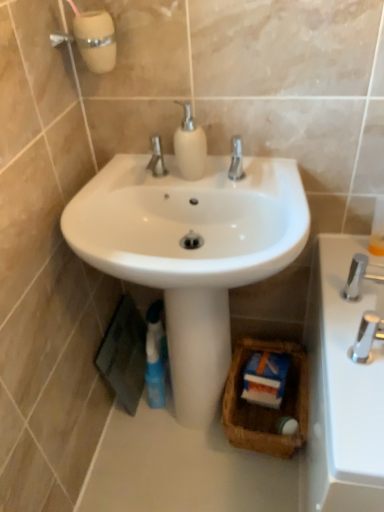
Find the location of a particular element. chrome metallic faucet at right, the second tap viewed from the back is located at coordinates (366, 336).

The width and height of the screenshot is (384, 512). What do you see at coordinates (155, 356) in the screenshot?
I see `blue glossy mouthwash at lower center` at bounding box center [155, 356].

In order to click on white matte soap dispenser at center in this screenshot , I will do point(190,145).

Find the location of a particular element. chrome metallic faucet at right, which is counted as the 1th tap, starting from the front is located at coordinates (366, 336).

Is white glossy sink at center facing towards blue glossy mouthwash at lower center?

No, white glossy sink at center does not turn towards blue glossy mouthwash at lower center.

Does white glossy sink at center have a greater height compared to blue glossy mouthwash at lower center?

No.

Is white glossy sink at center far from blue glossy mouthwash at lower center?

white glossy sink at center is near blue glossy mouthwash at lower center, not far away.

From a real-world perspective, does silver metallic tap at right, which is counted as the 1th tap, starting from the back, sit lower than chrome metallic faucet at right, which is counted as the 1th tap, starting from the front?

Yes, from a real-world perspective, silver metallic tap at right, which is counted as the 1th tap, starting from the back, is beneath chrome metallic faucet at right, which is counted as the 1th tap, starting from the front.

From the image's perspective, is silver metallic tap at right, arranged as the 2th tap when viewed from the front, positioned above or below chrome metallic faucet at right, the second tap viewed from the back?

silver metallic tap at right, arranged as the 2th tap when viewed from the front, is situated higher than chrome metallic faucet at right, the second tap viewed from the back, in the image.

Looking at their sizes, would you say silver metallic tap at right, which is counted as the 1th tap, starting from the back, is wider or thinner than chrome metallic faucet at right, which is counted as the 1th tap, starting from the front?

Clearly, silver metallic tap at right, which is counted as the 1th tap, starting from the back, has more width compared to chrome metallic faucet at right, which is counted as the 1th tap, starting from the front.

Does chrome metallic faucet at right, the second tap viewed from the back, have a greater width compared to silver metallic tap at right, arranged as the 2th tap when viewed from the front?

No.

From the image's perspective, which is below, chrome metallic faucet at right, the second tap viewed from the back, or silver metallic tap at right, arranged as the 2th tap when viewed from the front?

From the image's view, chrome metallic faucet at right, the second tap viewed from the back, is below.

From a real-world perspective, is chrome metallic faucet at right, which is counted as the 1th tap, starting from the front, below silver metallic tap at right, which is counted as the 1th tap, starting from the back?

No, from a real-world perspective, chrome metallic faucet at right, which is counted as the 1th tap, starting from the front, is not below silver metallic tap at right, which is counted as the 1th tap, starting from the back.

Is silver metallic tap at right, arranged as the 2th tap when viewed from the front, aimed at blue glossy mouthwash at lower center?

No, silver metallic tap at right, arranged as the 2th tap when viewed from the front, is not aimed at blue glossy mouthwash at lower center.

Does point (350, 284) appear closer or farther from the camera than point (164, 400)?

Clearly, point (350, 284) is closer to the camera than point (164, 400).

From the image's perspective, is silver metallic tap at right, arranged as the 2th tap when viewed from the front, located above blue glossy mouthwash at lower center?

Yes, from the image's perspective, silver metallic tap at right, arranged as the 2th tap when viewed from the front, is above blue glossy mouthwash at lower center.

Which is more to the left, silver metallic tap at right, arranged as the 2th tap when viewed from the front, or blue glossy mouthwash at lower center?

blue glossy mouthwash at lower center is more to the left.

Are brown woven basket at center and chrome metallic faucet at right, which is counted as the 1th tap, starting from the front, located far from each other?

Actually, brown woven basket at center and chrome metallic faucet at right, which is counted as the 1th tap, starting from the front, are a little close together.

Who is more distant, brown woven basket at center or chrome metallic faucet at right, which is counted as the 1th tap, starting from the front?

brown woven basket at center is further from the camera.

Is brown woven basket at center not inside chrome metallic faucet at right, the second tap viewed from the back?

Absolutely, brown woven basket at center is external to chrome metallic faucet at right, the second tap viewed from the back.

From the image's perspective, is brown woven basket at center under chrome metallic faucet at right, which is counted as the 1th tap, starting from the front?

Correct, brown woven basket at center appears lower than chrome metallic faucet at right, which is counted as the 1th tap, starting from the front, in the image.

Choose the correct answer: Is blue glossy mouthwash at lower center inside chrome metallic faucet at right, the second tap viewed from the back, or outside it?

blue glossy mouthwash at lower center is not enclosed by chrome metallic faucet at right, the second tap viewed from the back.

Find the location of a particular element. This screenshot has height=512, width=384. mouthwash on the left side of chrome metallic faucet at right, the second tap viewed from the back is located at coordinates (155, 356).

In the scene shown: Between blue glossy mouthwash at lower center and chrome metallic faucet at right, the second tap viewed from the back, which one has larger size?

blue glossy mouthwash at lower center.

Are blue glossy mouthwash at lower center and chrome metallic faucet at right, which is counted as the 1th tap, starting from the front, located far from each other?

No, blue glossy mouthwash at lower center is in close proximity to chrome metallic faucet at right, which is counted as the 1th tap, starting from the front.

Considering the relative sizes of blue glossy mouthwash at lower center and white matte soap dispenser at center in the image provided, is blue glossy mouthwash at lower center taller than white matte soap dispenser at center?

Correct, blue glossy mouthwash at lower center is much taller as white matte soap dispenser at center.

Is point (152, 307) in front of point (194, 142)?

No, (152, 307) is further to viewer.

Who is bigger, blue glossy mouthwash at lower center or white matte soap dispenser at center?

With larger size is blue glossy mouthwash at lower center.

Can you tell me how much blue glossy mouthwash at lower center and white matte soap dispenser at center differ in facing direction?

0.000546 degrees.

You are a GUI agent. You are given a task and a screenshot of the screen. Output one action in this format:
    pyautogui.click(x=<x>, y=<y>)
    Task: Click on the sink above the blue glossy mouthwash at lower center (from the image's perspective)
    
    Given the screenshot: What is the action you would take?
    pyautogui.click(x=189, y=222)

The height and width of the screenshot is (512, 384). Find the location of `tap lying on the left of silver metallic tap at right, which is counted as the 1th tap, starting from the back`. tap lying on the left of silver metallic tap at right, which is counted as the 1th tap, starting from the back is located at coordinates (366, 336).

Which object lies further to the anchor point white glossy sink at center, silver metallic tap at right, which is counted as the 1th tap, starting from the back, or blue glossy mouthwash at lower center?

blue glossy mouthwash at lower center lies further to white glossy sink at center than the other object.

Considering their positions, is chrome metallic faucet at right, the second tap viewed from the back, positioned further to white glossy sink at center than silver metallic tap at right, which is counted as the 1th tap, starting from the back?

Based on the image, chrome metallic faucet at right, the second tap viewed from the back, appears to be further to white glossy sink at center.

Considering their positions, is brown woven basket at center positioned further to silver metallic tap at right, arranged as the 2th tap when viewed from the front, than white matte soap dispenser at center?

Based on the image, brown woven basket at center appears to be further to silver metallic tap at right, arranged as the 2th tap when viewed from the front.

Based on their spatial positions, is silver metallic tap at right, which is counted as the 1th tap, starting from the back, or brown woven basket at center closer to white glossy sink at center?

The object closer to white glossy sink at center is silver metallic tap at right, which is counted as the 1th tap, starting from the back.

Looking at the image, which one is located further to chrome metallic faucet at right, which is counted as the 1th tap, starting from the front, white matte soap dispenser at center or brown woven basket at center?

The object further to chrome metallic faucet at right, which is counted as the 1th tap, starting from the front, is white matte soap dispenser at center.

From the image, which object appears to be nearer to blue glossy mouthwash at lower center, chrome metallic faucet at right, which is counted as the 1th tap, starting from the front, or silver metallic tap at right, which is counted as the 1th tap, starting from the back?

silver metallic tap at right, which is counted as the 1th tap, starting from the back.

From the image, which object appears to be farther from white glossy sink at center, silver metallic tap at right, arranged as the 2th tap when viewed from the front, or white matte soap dispenser at center?

silver metallic tap at right, arranged as the 2th tap when viewed from the front, is positioned further to the anchor white glossy sink at center.

From the image, which object appears to be nearer to white matte soap dispenser at center, silver metallic tap at right, which is counted as the 1th tap, starting from the back, or brown woven basket at center?

silver metallic tap at right, which is counted as the 1th tap, starting from the back, is positioned closer to the anchor white matte soap dispenser at center.

Find the location of a particular element. The height and width of the screenshot is (512, 384). sink between white matte soap dispenser at center and brown woven basket at center in the up-down direction is located at coordinates (189, 222).

At what (x,y) coordinates should I click in order to perform the action: click on tap between blue glossy mouthwash at lower center and silver metallic tap at right, arranged as the 2th tap when viewed from the front, from left to right. Please return your answer as a coordinate pair (x, y). This screenshot has width=384, height=512. Looking at the image, I should click on (366, 336).

This screenshot has height=512, width=384. I want to click on basket between chrome metallic faucet at right, the second tap viewed from the back, and blue glossy mouthwash at lower center, along the z-axis, so click(266, 407).

This screenshot has width=384, height=512. Find the location of `basket situated between blue glossy mouthwash at lower center and silver metallic tap at right, which is counted as the 1th tap, starting from the back, from left to right`. basket situated between blue glossy mouthwash at lower center and silver metallic tap at right, which is counted as the 1th tap, starting from the back, from left to right is located at coordinates (266, 407).